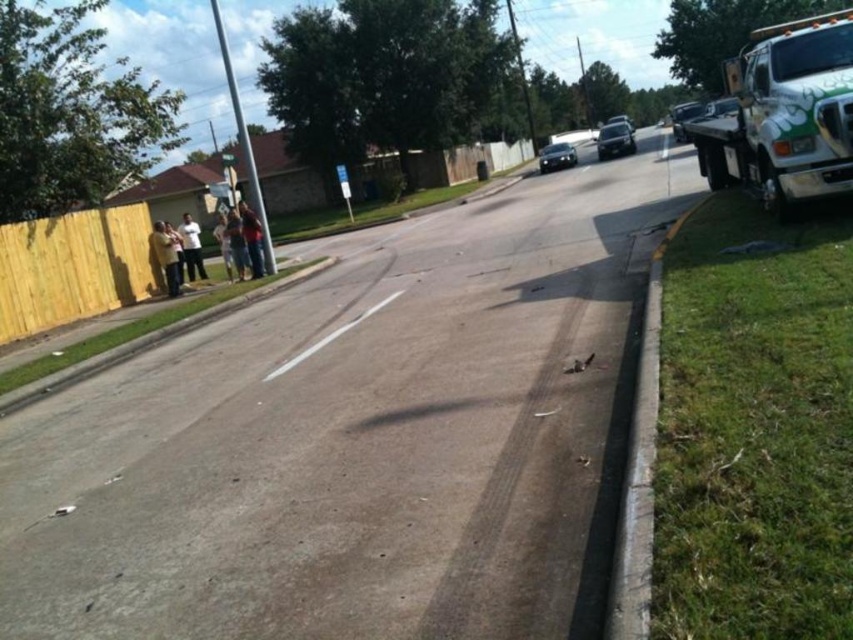
Does white cotton shirt at left appear under light brown fabric pants at left?

Indeed, white cotton shirt at left is positioned under light brown fabric pants at left.

Who is more distant from viewer, (175, 269) or (175, 243)?

Point (175, 243)

Where is `white cotton shirt at left`? The height and width of the screenshot is (640, 853). white cotton shirt at left is located at coordinates (166, 257).

At what (x,y) coordinates should I click in order to perform the action: click on white glossy tow truck at upper right. Please return your answer as a coordinate pair (x, y). The height and width of the screenshot is (640, 853). Looking at the image, I should click on (785, 115).

Measure the distance between white glossy tow truck at upper right and dark blue jeans at center.

10.22 meters

Measure the distance between white glossy tow truck at upper right and camera.

white glossy tow truck at upper right is 5.85 meters away from camera.

Identify the location of white glossy tow truck at upper right. Image resolution: width=853 pixels, height=640 pixels. (785, 115).

Does white cotton shirt at left appear on the right side of shiny black car at center?

In fact, white cotton shirt at left is to the left of shiny black car at center.

Is point (177, 292) in front of point (611, 131)?

Yes, point (177, 292) is closer to viewer.

Is point (173, 268) farther from viewer compared to point (604, 147)?

No, it is not.

You are a GUI agent. You are given a task and a screenshot of the screen. Output one action in this format:
    pyautogui.click(x=<x>, y=<y>)
    Task: Click on the white cotton shirt at left
    
    Given the screenshot: What is the action you would take?
    pyautogui.click(x=166, y=257)